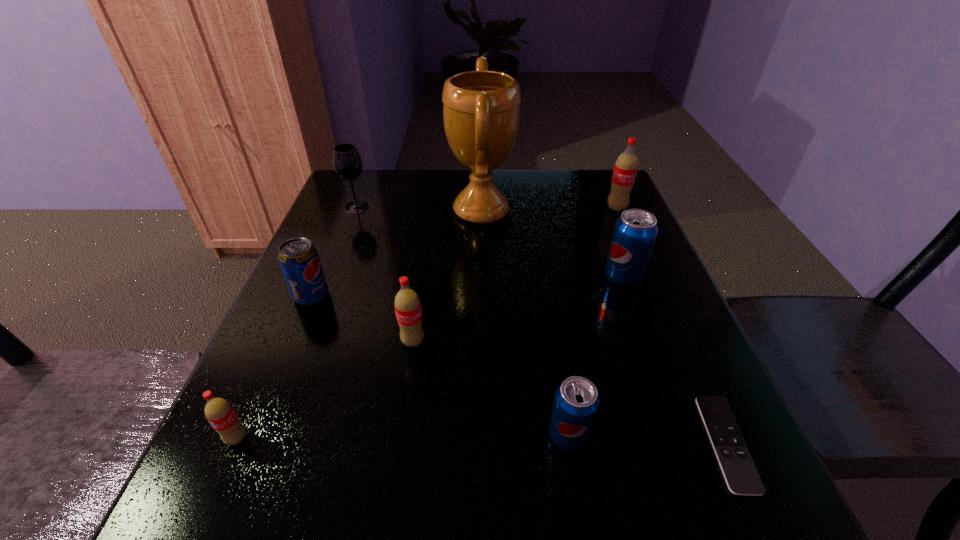
Locate an element on the screen. This screenshot has width=960, height=540. award is located at coordinates (481, 109).

This screenshot has width=960, height=540. In order to click on the tallest object in this screenshot , I will do `click(481, 109)`.

In order to click on the tallest pop soda in this screenshot , I will do `click(625, 169)`.

Image resolution: width=960 pixels, height=540 pixels. What are the coordinates of `the biggest red soda` in the screenshot? It's located at (625, 169).

The image size is (960, 540). In order to click on wineglass in this screenshot , I will do `click(347, 163)`.

The width and height of the screenshot is (960, 540). Identify the location of the farther blue pop soda. (635, 232).

Identify the location of the right blue pop soda. Image resolution: width=960 pixels, height=540 pixels. (635, 232).

The width and height of the screenshot is (960, 540). I want to click on the third nearest pop soda, so click(407, 304).

At what (x,y) coordinates should I click in order to perform the action: click on the fourth pop soda from right to left. Please return your answer as a coordinate pair (x, y). The image size is (960, 540). Looking at the image, I should click on (407, 304).

The width and height of the screenshot is (960, 540). I want to click on the leftmost red soda, so click(219, 412).